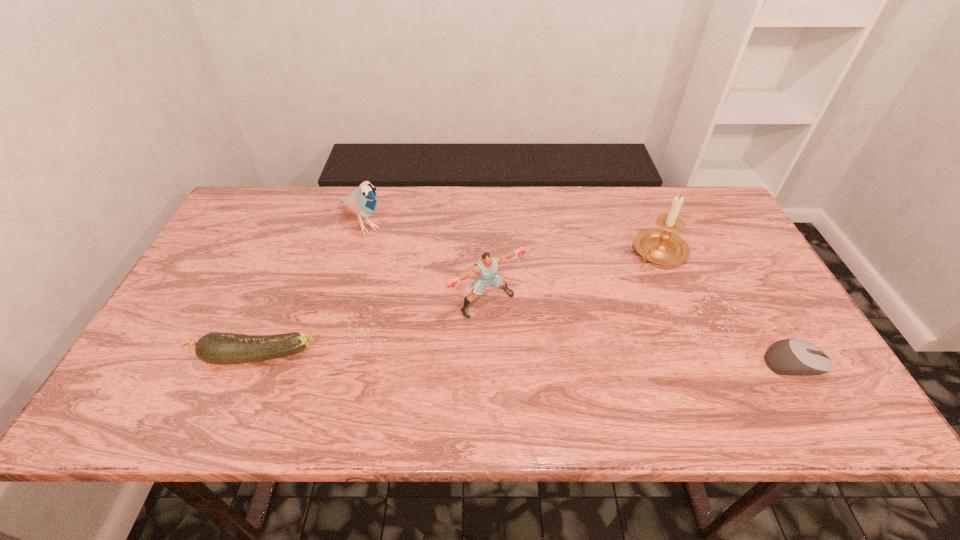
Find the location of a particular element. object that can be found as the second closest to the computer equipment is located at coordinates (486, 267).